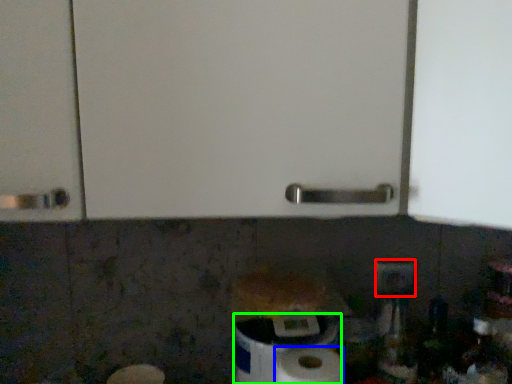
Question: Estimate the real-world distances between objects in this image. Which object is farther from electric outlet (highlighted by a red box), paper towel (highlighted by a blue box) or toilet paper (highlighted by a green box)?

Choices:
 (A) paper towel
 (B) toilet paper

Answer: (A)